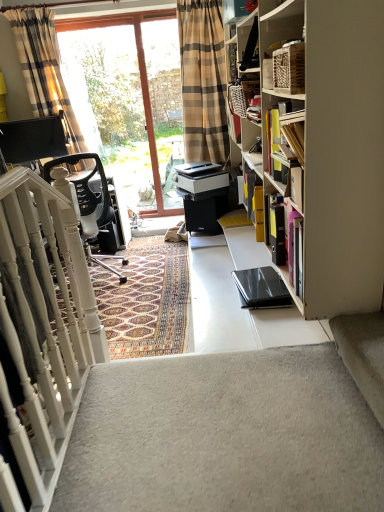
Find the location of `vacant region above plaid fabric curtain at upper left (from a real-world perspective)`. vacant region above plaid fabric curtain at upper left (from a real-world perspective) is located at coordinates (33, 7).